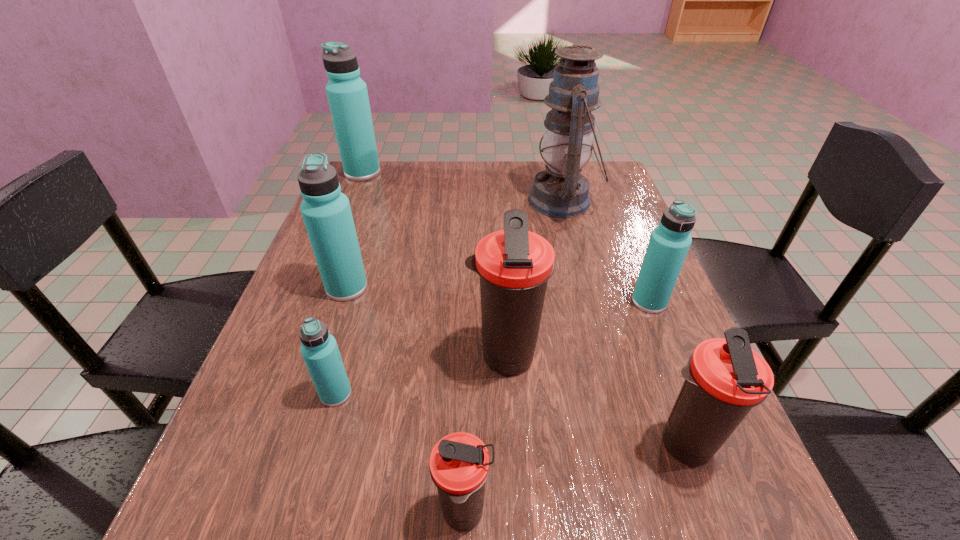
Find the location of a particular element. vacant space that's between the second smallest brown thermos bottle and the oil lamp is located at coordinates (623, 323).

Find the location of a particular element. The image size is (960, 540). vacant area that lies between the second smallest brown thermos bottle and the farthest brown thermos bottle is located at coordinates (594, 402).

You are a GUI agent. You are given a task and a screenshot of the screen. Output one action in this format:
    pyautogui.click(x=<x>, y=<y>)
    Task: Click on the second closest object to the oil lamp
    
    Given the screenshot: What is the action you would take?
    [x=514, y=265]

Point out which object is positioned as the fifth nearest to the biggest aqua thermos bottle. Please provide its 2D coordinates. Your answer should be formatted as a tuple, i.e. [(x, y)], where the tuple contains the x and y coordinates of a point satisfying the conditions above.

[(669, 243)]

Choose which thermos bottle is the third nearest neighbor to the second nearest object. Please provide its 2D coordinates. Your answer should be formatted as a tuple, i.e. [(x, y)], where the tuple contains the x and y coordinates of a point satisfying the conditions above.

[(459, 466)]

Identify the location of the closest thermos bottle to the oil lamp. Image resolution: width=960 pixels, height=540 pixels. (669, 243).

I want to click on aqua thermos bottle that is the closest to the nearest object, so click(x=319, y=349).

Identify which aqua thermos bottle is located as the third nearest to the farthest aqua thermos bottle. Please provide its 2D coordinates. Your answer should be formatted as a tuple, i.e. [(x, y)], where the tuple contains the x and y coordinates of a point satisfying the conditions above.

[(669, 243)]

Identify which brown thermos bottle is located as the second nearest to the seventh farthest object. Please provide its 2D coordinates. Your answer should be formatted as a tuple, i.e. [(x, y)], where the tuple contains the x and y coordinates of a point satisfying the conditions above.

[(459, 466)]

What are the coordinates of `brown thermos bottle that can be found as the second closest to the oil lamp` in the screenshot? It's located at (724, 378).